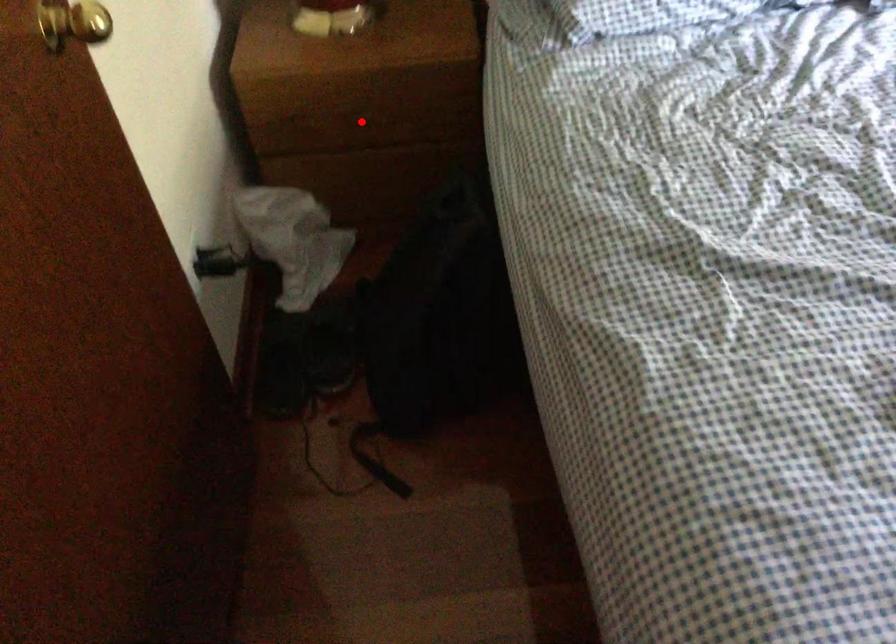
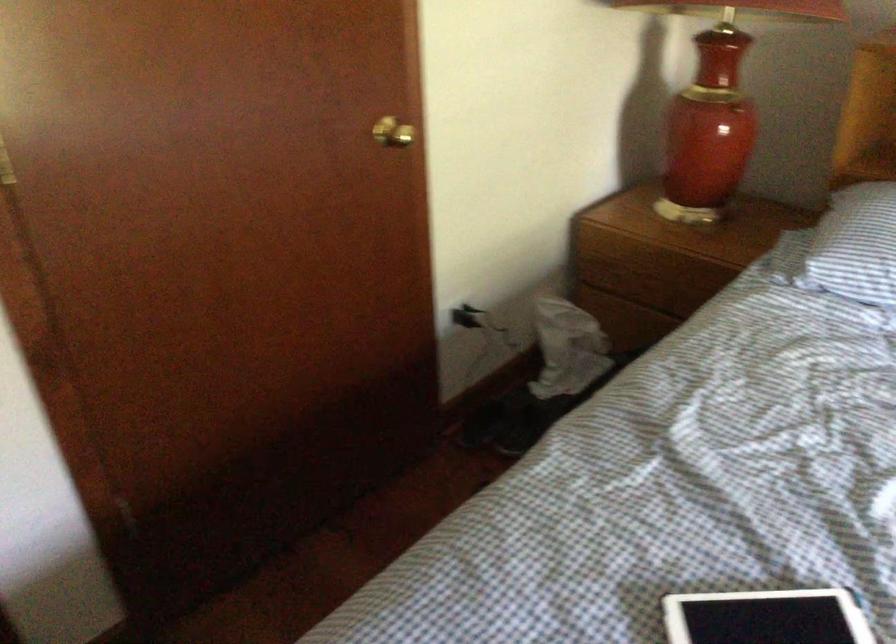
The point at the highlighted location is marked in the first image. Where is the corresponding point in the second image?

(650, 283)